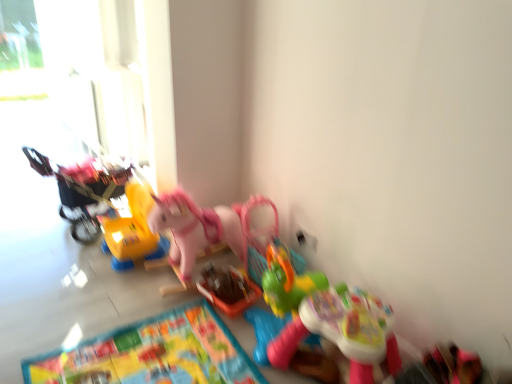
Locate an element on the screen. The height and width of the screenshot is (384, 512). free space underneath pink plastic rocking horse at center, the 4th toy in the left-to-right sequence (from a real-world perspective) is located at coordinates (206, 269).